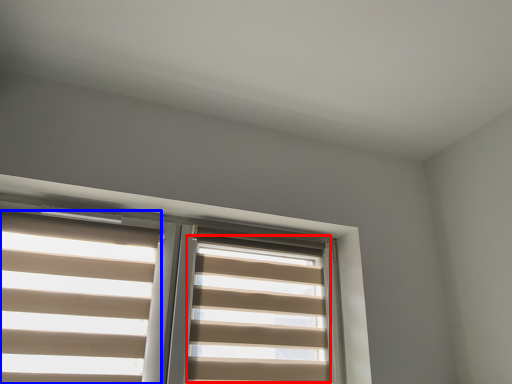
Question: Among these objects, which one is farthest to the camera, blind (highlighted by a red box) or blind (highlighted by a blue box)?

Choices:
 (A) blind
 (B) blind

Answer: (A)